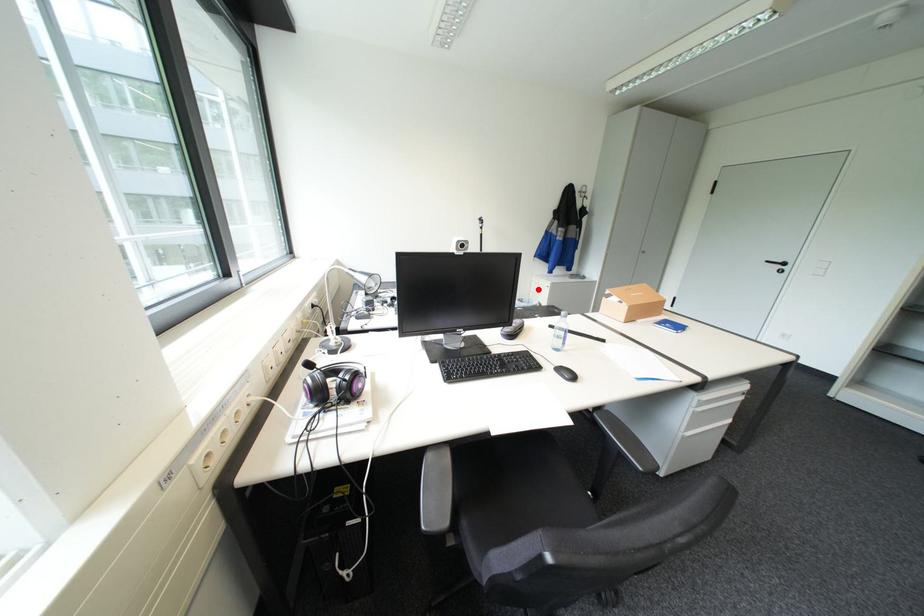
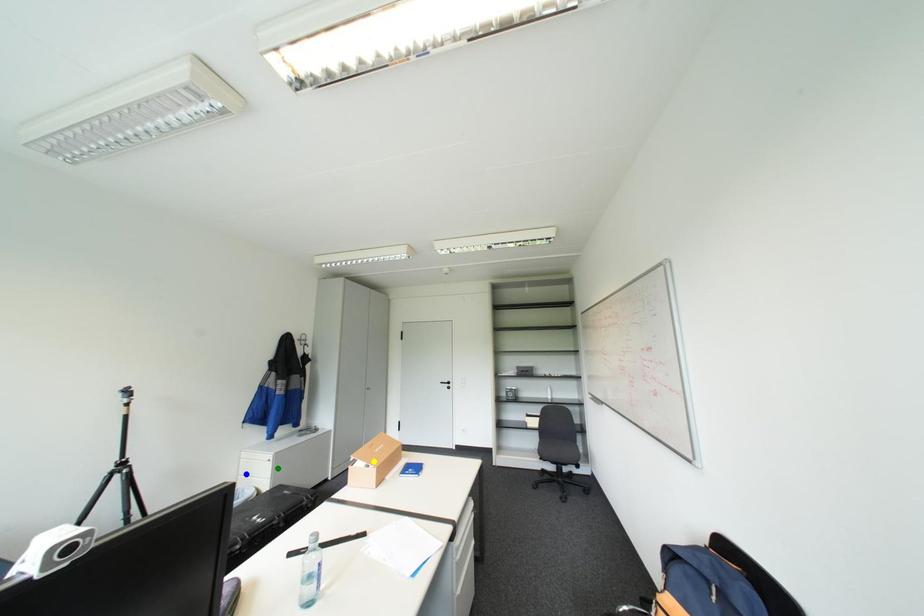
Question: I am providing you with two images of the same scene from different viewpoints. A red point is marked on the first image. You are given multiple points on the second image. Can you choose the point in image 2 that corresponds to the point in image 1?

Choices:
 (A) green point
 (B) blue point
 (C) yellow point

Answer: (B)